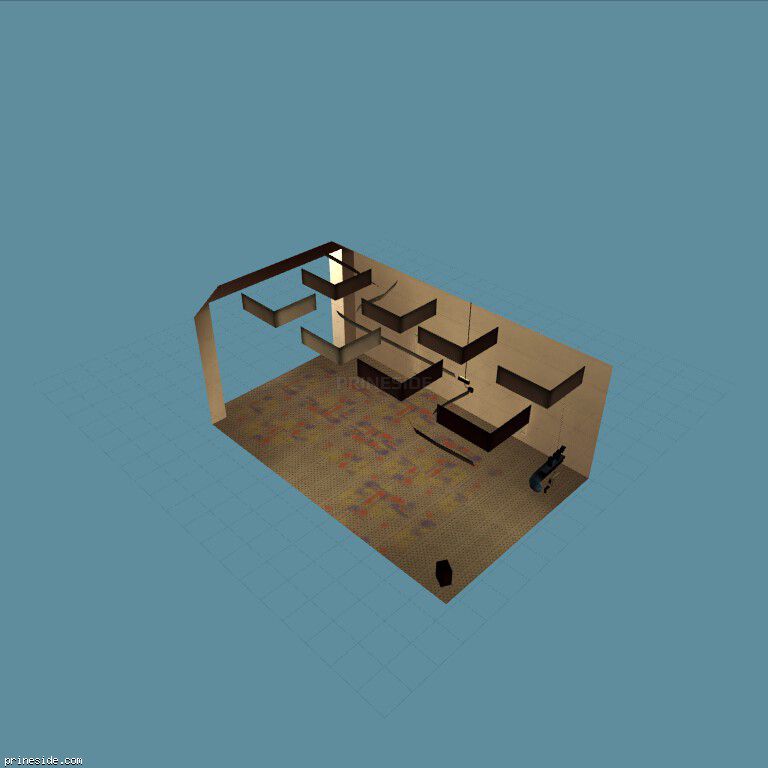
Find the location of a particular element. The width and height of the screenshot is (768, 768). floor is located at coordinates (166, 601).